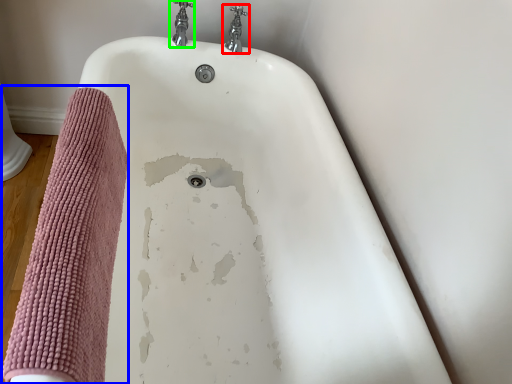
Question: Considering the real-world distances, which object is farthest from tap (highlighted by a red box)? bath towel (highlighted by a blue box) or tap (highlighted by a green box)?

Choices:
 (A) bath towel
 (B) tap

Answer: (A)